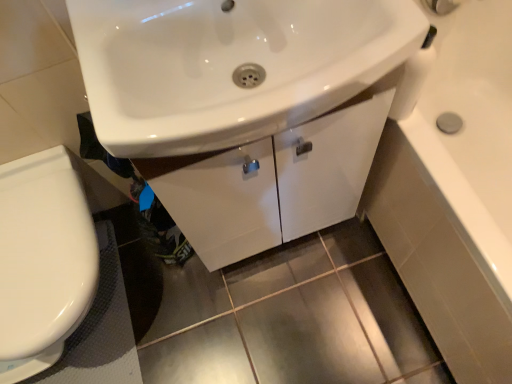
This screenshot has width=512, height=384. Find the location of `blank space above white glossy toilet at lower left (from a real-world perspective)`. blank space above white glossy toilet at lower left (from a real-world perspective) is located at coordinates (35, 250).